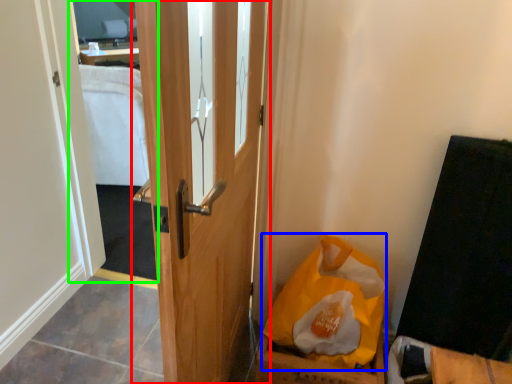
Question: Considering the real-world distances, which object is farthest from door (highlighted by a red box)? paper bag (highlighted by a blue box) or mirror (highlighted by a green box)?

Choices:
 (A) paper bag
 (B) mirror

Answer: (B)